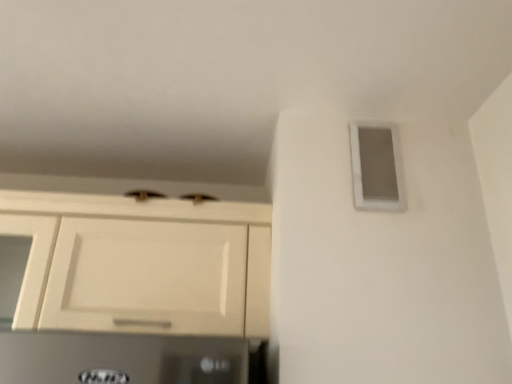
Image resolution: width=512 pixels, height=384 pixels. Find the location of `white glass window at upper right`. white glass window at upper right is located at coordinates (377, 167).

What do you see at coordinates (377, 167) in the screenshot? Image resolution: width=512 pixels, height=384 pixels. I see `white glass window at upper right` at bounding box center [377, 167].

Find the location of `white glass window at upper right`. white glass window at upper right is located at coordinates (377, 167).